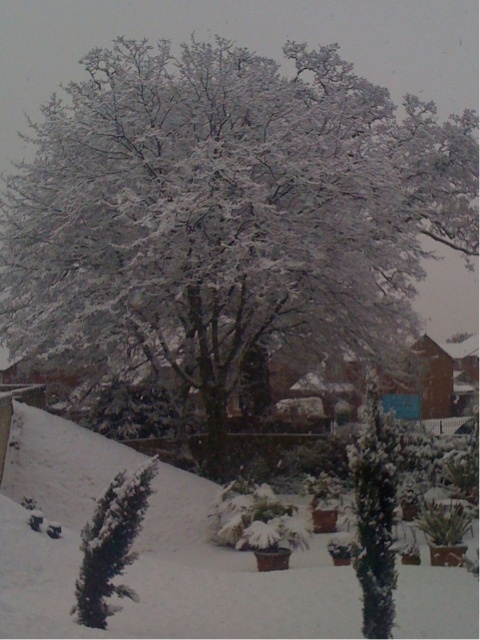
Question: Which of the following is the closest to the observer?

Choices:
 (A) green textured bush at lower left
 (B) green matte evergreen tree at center

Answer: (B)

Question: Does white fluffy snow at center appear over green matte evergreen tree at center?

Choices:
 (A) no
 (B) yes

Answer: (A)

Question: Which object is the farthest from the white frosty tree at upper center?

Choices:
 (A) green textured bush at lower left
 (B) white fluffy snow at center
 (C) green matte evergreen tree at center

Answer: (C)

Question: Observing the image, what is the correct spatial positioning of white frosty tree at upper center in reference to green matte evergreen tree at center?

Choices:
 (A) below
 (B) above

Answer: (B)

Question: Can you confirm if green matte evergreen tree at center is wider than green textured bush at lower left?

Choices:
 (A) yes
 (B) no

Answer: (B)

Question: Among these points, which one is farthest from the camera?

Choices:
 (A) (252, 52)
 (B) (388, 465)
 (C) (118, 484)

Answer: (A)